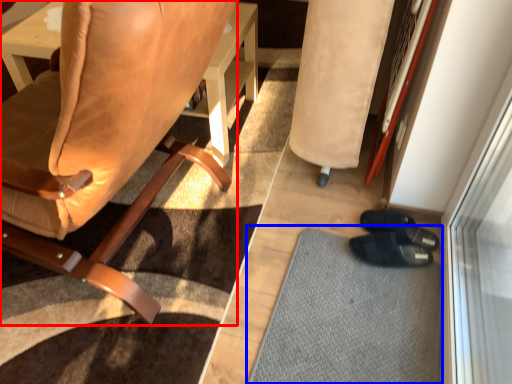
Question: Which point is closer to the camera, chair (highlighted by a red box) or doormat (highlighted by a blue box)?

Choices:
 (A) chair
 (B) doormat

Answer: (A)